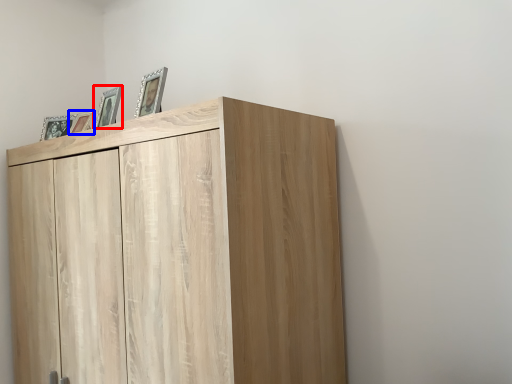
Question: Which point is further to the camera, picture frame (highlighted by a red box) or picture frame (highlighted by a blue box)?

Choices:
 (A) picture frame
 (B) picture frame

Answer: (B)